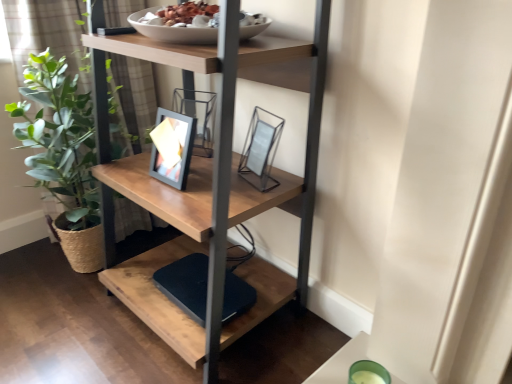
The width and height of the screenshot is (512, 384). In order to click on vacant space situated on the left part of wooden shelf at center in this screenshot , I will do (x=61, y=328).